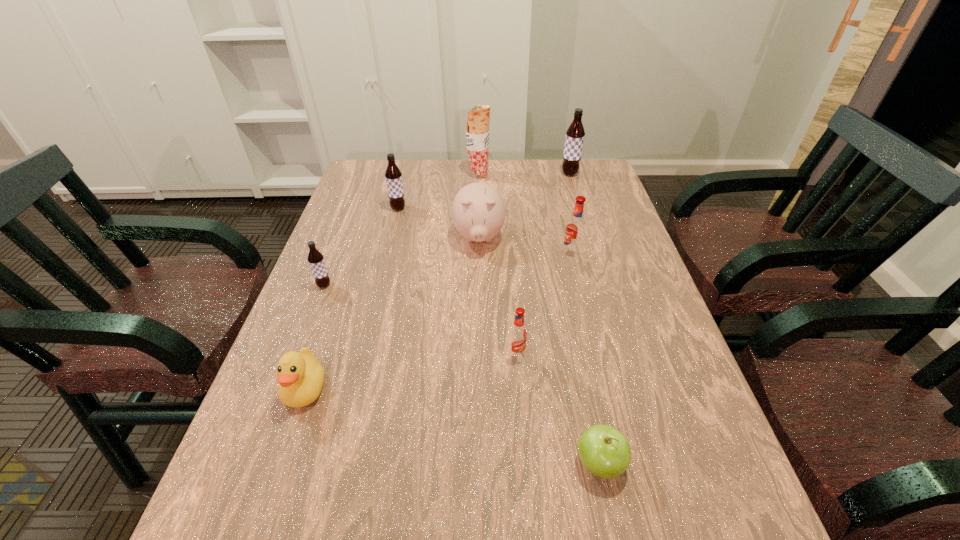
Find the location of a particular element. This screenshot has width=960, height=540. the left red root beer is located at coordinates [518, 333].

Identify the location of the smaller red root beer. The image size is (960, 540). (518, 333).

At what (x,y) coordinates should I click in order to perform the action: click on the eighth tallest object. Please return your answer as a coordinate pair (x, y). This screenshot has height=540, width=960. Looking at the image, I should click on (300, 376).

Image resolution: width=960 pixels, height=540 pixels. Find the location of `the eighth farthest object`. the eighth farthest object is located at coordinates (300, 376).

Where is `green apple`? This screenshot has width=960, height=540. green apple is located at coordinates (604, 451).

Find the location of a particular element. Image resolution: width=960 pixels, height=540 pixels. the shortest object is located at coordinates (604, 451).

The height and width of the screenshot is (540, 960). Find the location of `vacant space positioned on the right of the burrito`. vacant space positioned on the right of the burrito is located at coordinates (539, 174).

Locate an element on the screen. vacant area located on the left of the tallest root beer is located at coordinates (497, 174).

Identify the location of vacant space located 0.140m on the back of the right red root beer. The width and height of the screenshot is (960, 540). (563, 220).

Image resolution: width=960 pixels, height=540 pixels. I want to click on free location located 0.090m on the front of the seventh object from right to left, so [393, 230].